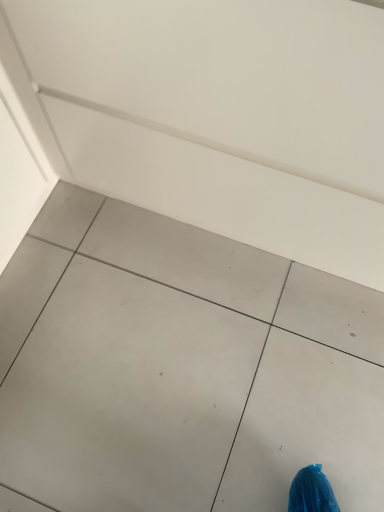
This screenshot has height=512, width=384. Find the location of `vacant point above gray tile floor at center (from a real-world perspective)`. vacant point above gray tile floor at center (from a real-world perspective) is located at coordinates (165, 356).